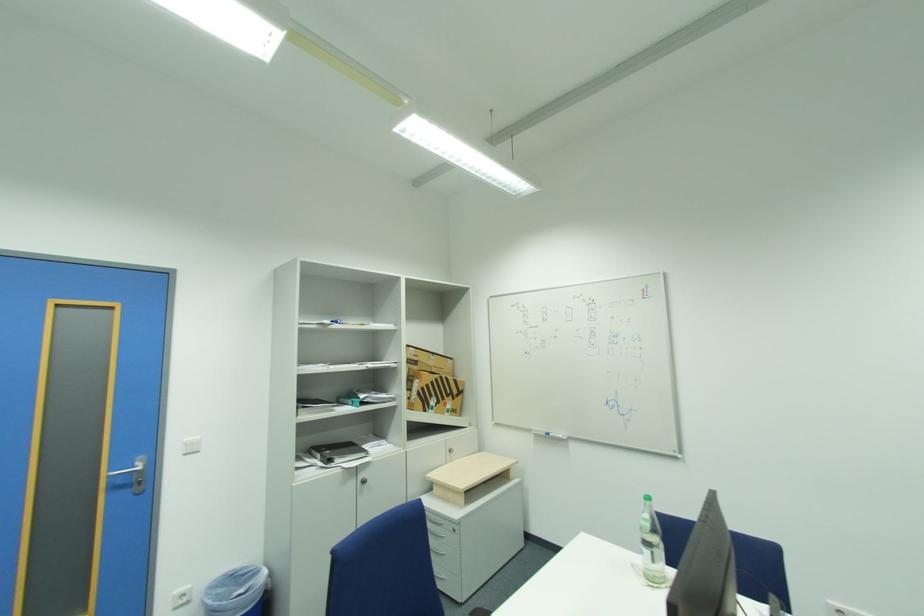
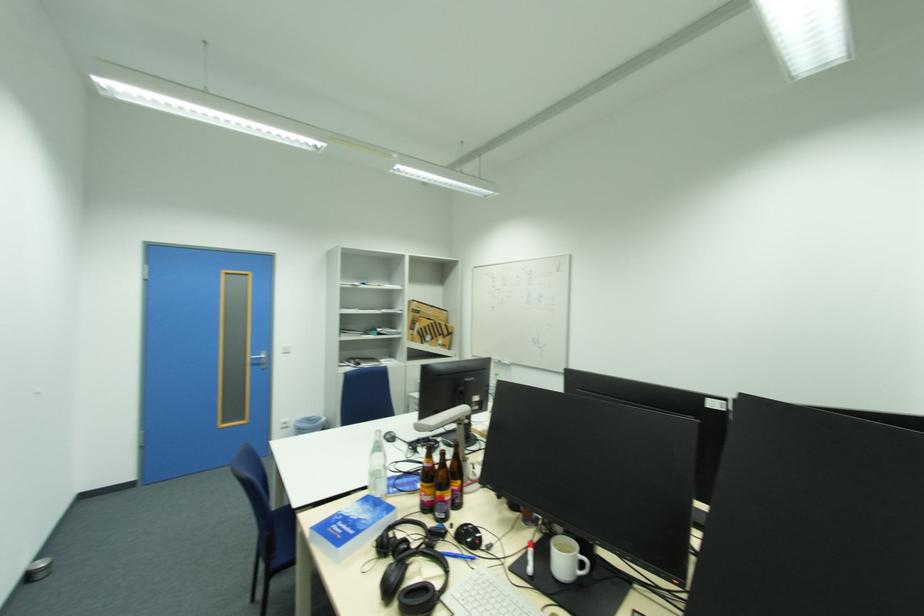
Locate, in the second image, the point that corresponds to point 191,440 in the first image.

(289, 347)